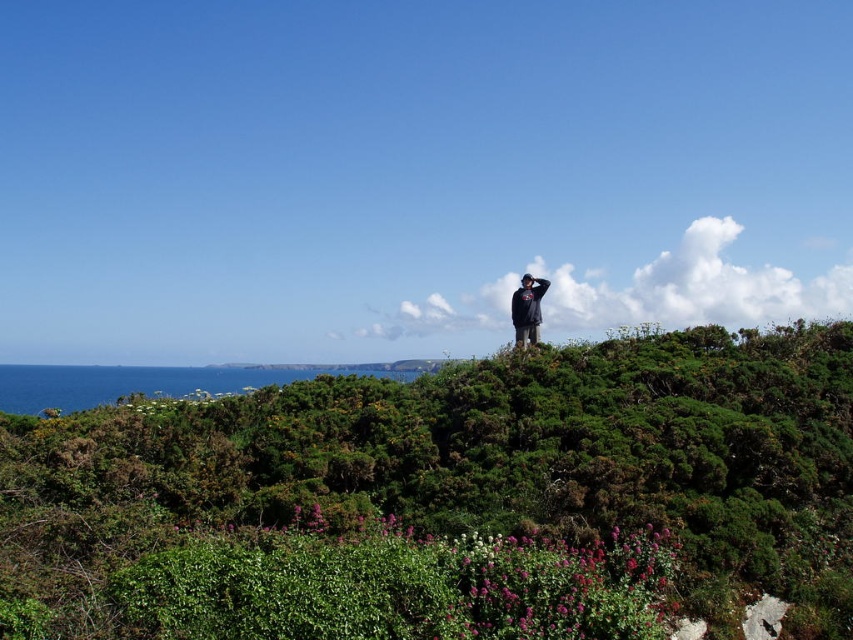
Question: Which point is closer to the camera?

Choices:
 (A) (512, 316)
 (B) (738, 561)

Answer: (B)

Question: Does green leafy shrubs at center appear on the left side of dark blue sweatshirt at center?

Choices:
 (A) no
 (B) yes

Answer: (A)

Question: Among these objects, which one is nearest to the camera?

Choices:
 (A) green leafy shrubs at center
 (B) dark blue sweatshirt at center

Answer: (A)

Question: Does green leafy shrubs at center appear on the left side of dark blue sweatshirt at center?

Choices:
 (A) no
 (B) yes

Answer: (A)

Question: Which of the following is the farthest from the observer?

Choices:
 (A) (525, 340)
 (B) (579, 524)

Answer: (A)

Question: Is green leafy shrubs at center below dark blue sweatshirt at center?

Choices:
 (A) yes
 (B) no

Answer: (A)